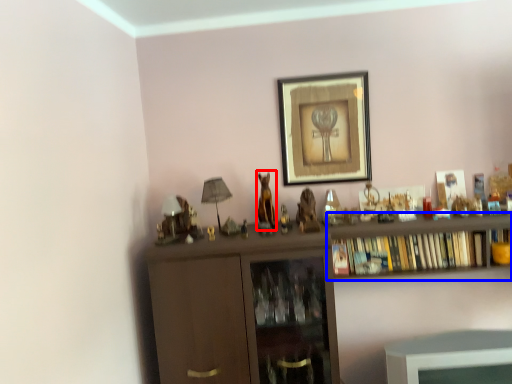
Question: Among these objects, which one is nearest to the camera, animal (highlighted by a red box) or shelf (highlighted by a blue box)?

Choices:
 (A) animal
 (B) shelf

Answer: (B)